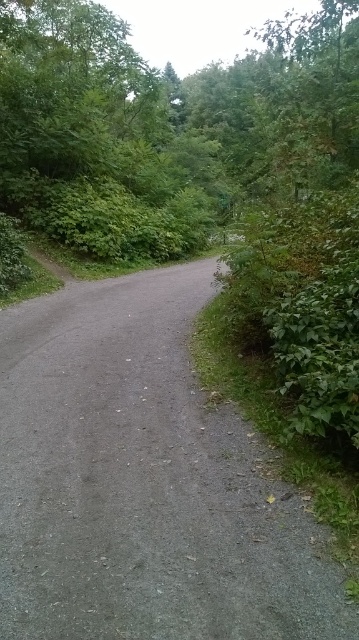
Which is in front, point (61, 323) or point (184, 106)?

Point (61, 323)

Is gray gravel road at center above green leafy tree at center?

Actually, gray gravel road at center is below green leafy tree at center.

Where is `gray gravel road at center`? gray gravel road at center is located at coordinates (142, 481).

The image size is (359, 640). What are the coordinates of `gray gravel road at center` in the screenshot? It's located at (142, 481).